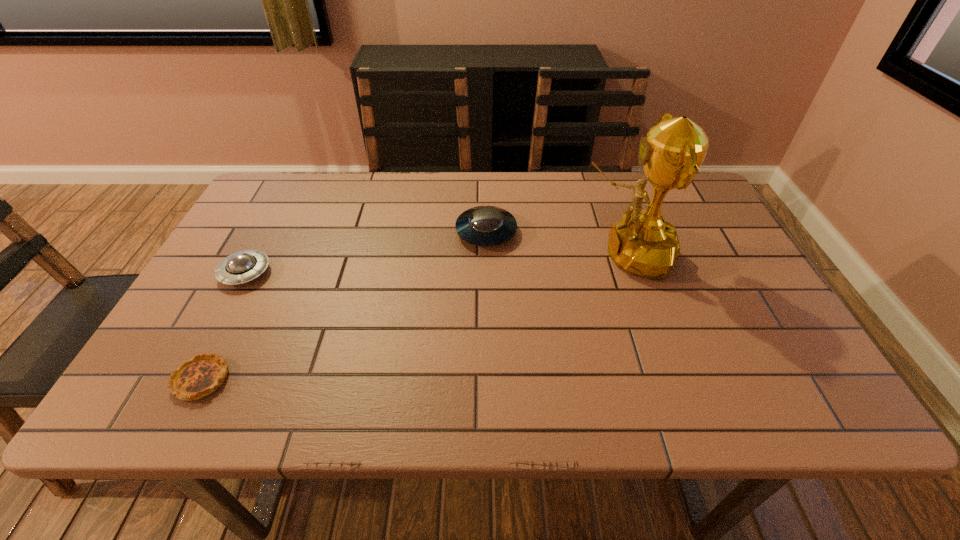
Where is `free region located 0.320m on the left of the farther saucer`? Image resolution: width=960 pixels, height=540 pixels. free region located 0.320m on the left of the farther saucer is located at coordinates (338, 232).

Where is `vacant space located 0.070m on the back of the nearer saucer`? This screenshot has width=960, height=540. vacant space located 0.070m on the back of the nearer saucer is located at coordinates (264, 238).

You are a GUI agent. You are given a task and a screenshot of the screen. Output one action in this format:
    pyautogui.click(x=<x>, y=<y>)
    Task: Click on the vacant space located on the back of the shortest object
    The image size is (960, 540).
    Given the screenshot: What is the action you would take?
    point(270,246)

Where is `object situated at the far edge`? The height and width of the screenshot is (540, 960). object situated at the far edge is located at coordinates (484, 225).

At what (x,y) coordinates should I click in order to perform the action: click on object at the near edge. Please return your answer as a coordinate pair (x, y). The height and width of the screenshot is (540, 960). Looking at the image, I should click on (202, 375).

The image size is (960, 540). Identify the location of saucer located at the left edge. click(243, 266).

The width and height of the screenshot is (960, 540). Find the location of `quiche at the left edge`. quiche at the left edge is located at coordinates (202, 375).

You are a GUI agent. You are given a task and a screenshot of the screen. Output one action in this format:
    pyautogui.click(x=<x>, y=<y>)
    Task: Click on the object positioned at the near left corner
    
    Given the screenshot: What is the action you would take?
    pyautogui.click(x=202, y=375)

I want to click on vacant space at the far edge of the desktop, so 450,186.

Identify the location of free space at the near edge of the desktop. The image size is (960, 540). (528, 400).